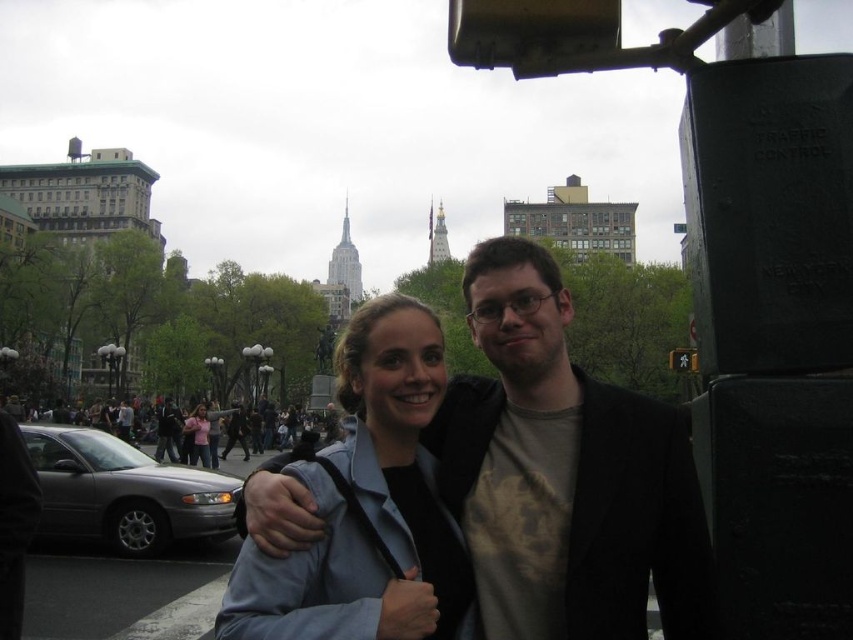
You are a photographer trying to capture the couple in the scene. The pink fabric shirt at center and dark gray jacket at center are both in your viewfinder. According to the scene, which clothing item is located to the right side of the other?

The pink fabric shirt at center is positioned on the right side of dark gray jacket at center.

You are a photographer standing in the city square. You want to take a photo of the matte black jacket at center and the metallic black traffic light at right. Which object should you zoom in on to capture both in the frame without moving your camera?

You should zoom in on the metallic black traffic light at right because the matte black jacket at center is much taller than it, so zooming in on the smaller object allows both to fit in the frame.

You are a fashion designer observing the couple in the city scene. You notice the pink fabric shirt at center and the dark gray jacket at center. Which clothing item appears smaller in size?

The pink fabric shirt at center has a smaller size compared to the dark gray jacket at center.